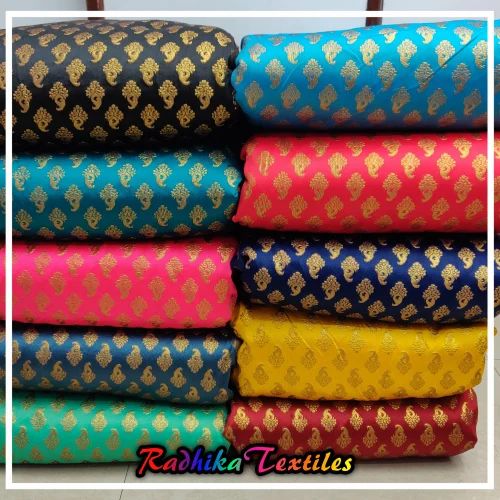
Find the location of a particular element. This screenshot has height=500, width=500. frame is located at coordinates (269, 487).